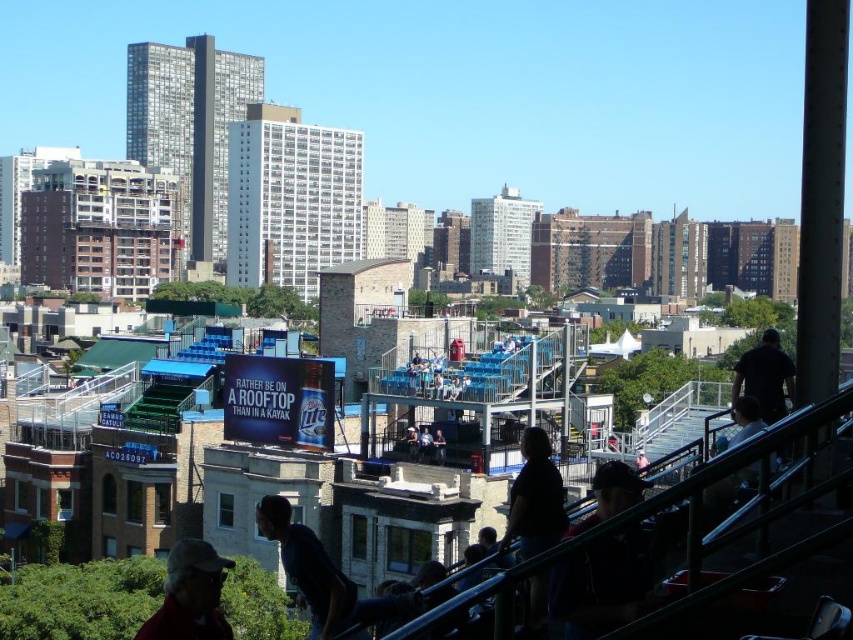
In the scene shown: Which is more to the left, dark blue shirt at center or dark matte shirt at lower right?

dark blue shirt at center is more to the left.

Consider the image. Does dark blue shirt at center appear on the left side of dark matte shirt at lower right?

Correct, you'll find dark blue shirt at center to the left of dark matte shirt at lower right.

Find the location of a particular element. dark blue shirt at center is located at coordinates coord(308,568).

Can you confirm if red fabric cap at lower left is positioned below black matte shirt at upper right?

Yes, red fabric cap at lower left is below black matte shirt at upper right.

You are a GUI agent. You are given a task and a screenshot of the screen. Output one action in this format:
    pyautogui.click(x=<x>, y=<y>)
    Task: Click on the red fabric cap at lower left
    
    Given the screenshot: What is the action you would take?
    pyautogui.click(x=190, y=595)

Is dark blue shirt at center behind red fabric cap at lower left?

Yes, dark blue shirt at center is further from the viewer.

Is dark blue shirt at center smaller than red fabric cap at lower left?

Yes.

Which is behind, point (318, 602) or point (227, 566)?

The point (318, 602) is more distant.

Locate an element on the screen. The image size is (853, 640). dark blue shirt at center is located at coordinates (308, 568).